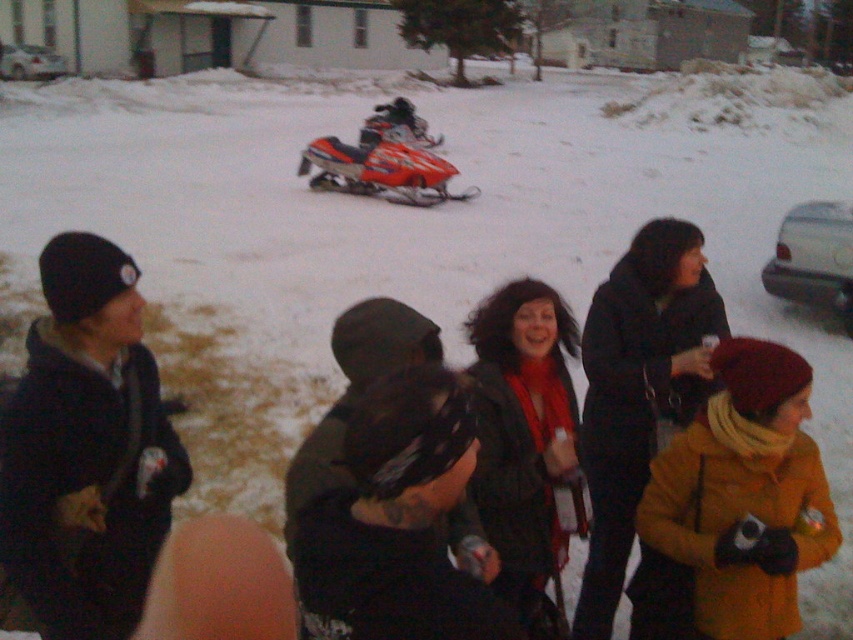
Does black matte jacket at left lie behind dark green jacket at center?

No.

Is black matte jacket at left smaller than dark green jacket at center?

No, black matte jacket at left is not smaller than dark green jacket at center.

Where is `black matte jacket at left`? Image resolution: width=853 pixels, height=640 pixels. black matte jacket at left is located at coordinates coord(86,449).

Find the location of `black matte jacket at left`. black matte jacket at left is located at coordinates (86, 449).

Who is taller, black matte jacket at center or shiny orange snowmobile at center?

shiny orange snowmobile at center is taller.

Is black matte jacket at center closer to the viewer compared to shiny orange snowmobile at center?

Yes, it is in front of shiny orange snowmobile at center.

Between point (509, 618) and point (402, 173), which one is positioned in front?

Positioned in front is point (509, 618).

Identify the location of black matte jacket at center. The height and width of the screenshot is (640, 853). (396, 522).

This screenshot has height=640, width=853. What do you see at coordinates (639, 390) in the screenshot?
I see `dark gray coat at center` at bounding box center [639, 390].

Where is `dark gray coat at center`? The height and width of the screenshot is (640, 853). dark gray coat at center is located at coordinates (639, 390).